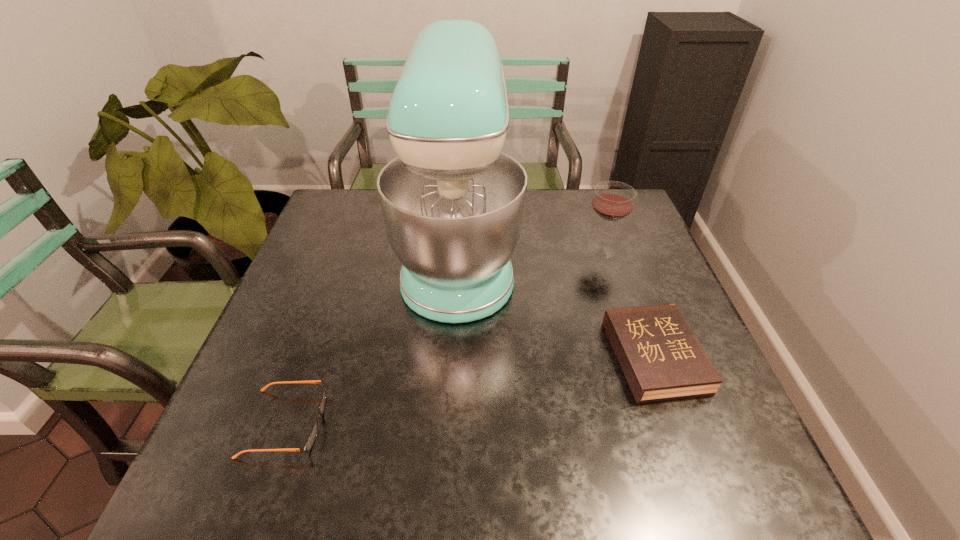
Identify the location of blank space at the far left corner of the desktop. [317, 221].

In the image, there is a desktop. Identify the location of free space at the near left corner. (245, 474).

Where is `free space at the far right corner of the desktop`? free space at the far right corner of the desktop is located at coordinates (590, 215).

This screenshot has width=960, height=540. In order to click on free spot between the leftmost object and the hardback book in this screenshot , I will do `click(470, 390)`.

Locate an element on the screen. unoccupied area between the second object from left to right and the second tallest object is located at coordinates (530, 253).

Identify the location of vacant area that lies between the third object from right to left and the shortest object. The image size is (960, 540). (372, 339).

Where is `free space between the third shortest object and the spectacles`? This screenshot has width=960, height=540. free space between the third shortest object and the spectacles is located at coordinates (x=444, y=336).

Locate an element on the screen. The width and height of the screenshot is (960, 540). free spot between the tallest object and the wineglass is located at coordinates (530, 253).

This screenshot has width=960, height=540. Find the location of `vacant space in between the tallest object and the wineglass`. vacant space in between the tallest object and the wineglass is located at coordinates (530, 253).

Find the location of a particular element. This screenshot has height=540, width=960. vacant space that is in between the spectacles and the hardback book is located at coordinates (470, 390).